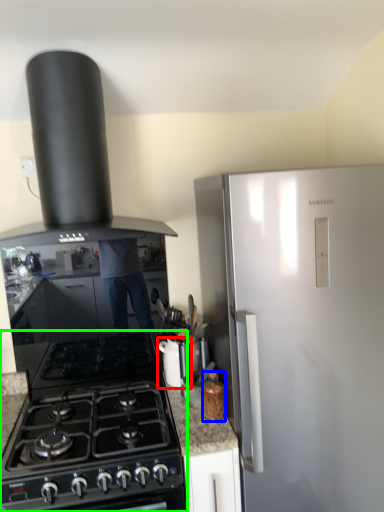
Question: Which is nearer to the kitchen appliance (highlighted by a red box)? kitchen appliance (highlighted by a blue box) or gas stove (highlighted by a green box).

Choices:
 (A) kitchen appliance
 (B) gas stove

Answer: (A)